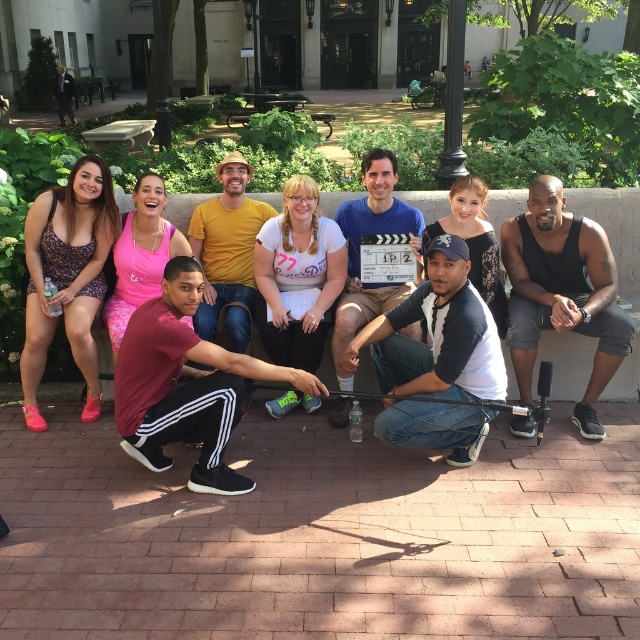
Question: Does maroon fabric pants at lower left appear on the right side of yellow cotton shirt at center?

Choices:
 (A) no
 (B) yes

Answer: (B)

Question: Can you confirm if dark gray cotton shirt at center is positioned below wooden park bench at center?

Choices:
 (A) yes
 (B) no

Answer: (A)

Question: Which of these objects is positioned closest to the yellow cotton shirt at center?

Choices:
 (A) maroon fabric pants at lower left
 (B) floral fabric romper at left

Answer: (A)

Question: Estimate the real-world distances between objects in this image. Which object is closer to the maroon fabric pants at lower left?

Choices:
 (A) dark gray suit at upper left
 (B) dark gray cotton shirt at center

Answer: (B)

Question: Which point is farther from the camera taking this photo?

Choices:
 (A) (145, 144)
 (B) (404, 390)
 (C) (58, 96)
 (D) (556, 221)

Answer: (C)

Question: Does maroon fabric pants at lower left appear over yellow cotton shirt at center?

Choices:
 (A) yes
 (B) no

Answer: (B)